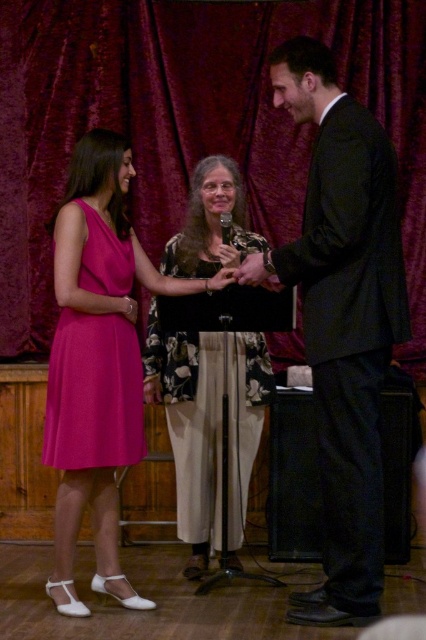
Question: Does pink satin dress at left lie behind matte pink dress at left?

Choices:
 (A) yes
 (B) no

Answer: (A)

Question: Is pink satin dress at left wider than black plastic microphone at center?

Choices:
 (A) yes
 (B) no

Answer: (A)

Question: Which point is closer to the camera?

Choices:
 (A) velvet dark red curtain at upper center
 (B) floral-patterned blouse at center

Answer: (B)

Question: Which point appears closest to the camera in this image?

Choices:
 (A) (46, 460)
 (B) (227, 212)
 (C) (203, 452)

Answer: (A)

Question: Which point is closer to the camera taking this photo?

Choices:
 (A) (0, 312)
 (B) (230, 220)
 (C) (43, 444)

Answer: (B)

Question: Is velvet dark red curtain at upper center thinner than floral-patterned blouse at center?

Choices:
 (A) no
 (B) yes

Answer: (A)